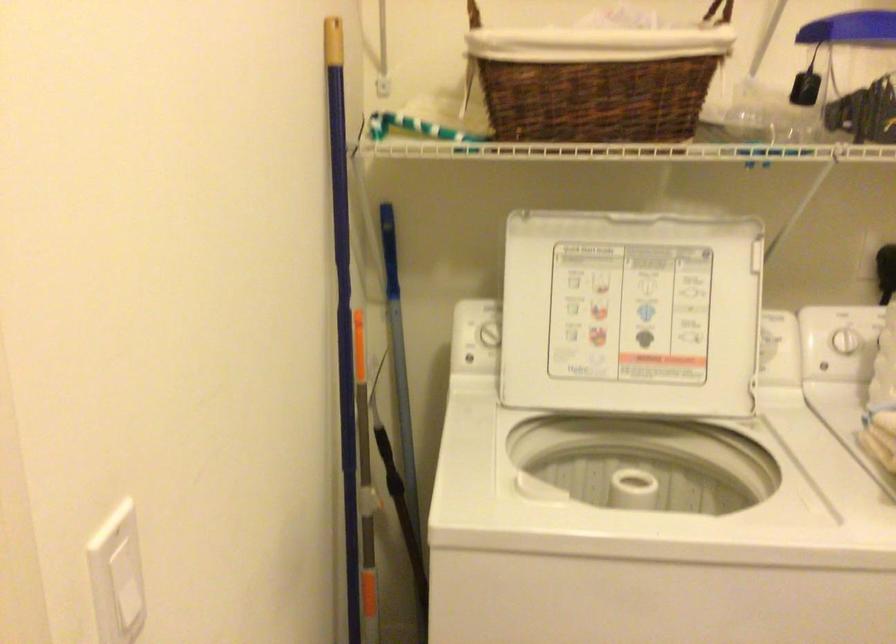
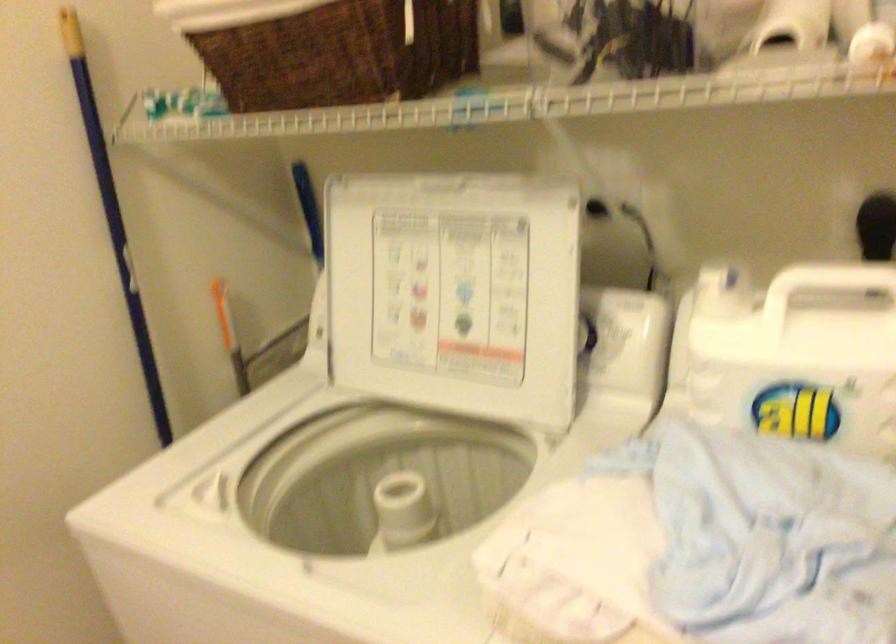
Where in the second image is the point corresponding to (655,104) from the first image?

(340, 53)